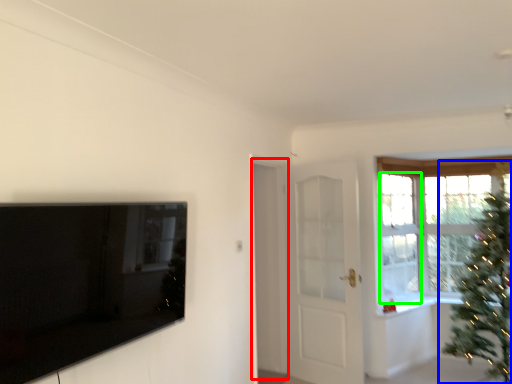
Question: Which is nearer to the screen door (highlighted by a red box)? christmas tree (highlighted by a blue box) or window (highlighted by a green box).

Choices:
 (A) christmas tree
 (B) window

Answer: (B)